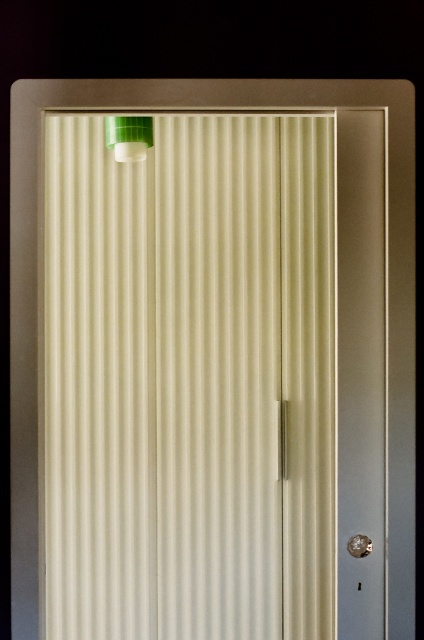
Question: Does white ribbed curtain at upper center have a greater width compared to green plastic cap at upper left?

Choices:
 (A) no
 (B) yes

Answer: (B)

Question: Among these objects, which one is nearest to the camera?

Choices:
 (A) white ribbed curtain at upper center
 (B) green plastic cap at upper left

Answer: (B)

Question: Is white ribbed curtain at upper center to the left of green plastic cap at upper left from the viewer's perspective?

Choices:
 (A) no
 (B) yes

Answer: (A)

Question: Does white ribbed curtain at upper center lie behind green plastic cap at upper left?

Choices:
 (A) yes
 (B) no

Answer: (A)

Question: Among these points, which one is farthest from the camera?

Choices:
 (A) (97, 616)
 (B) (120, 132)

Answer: (A)